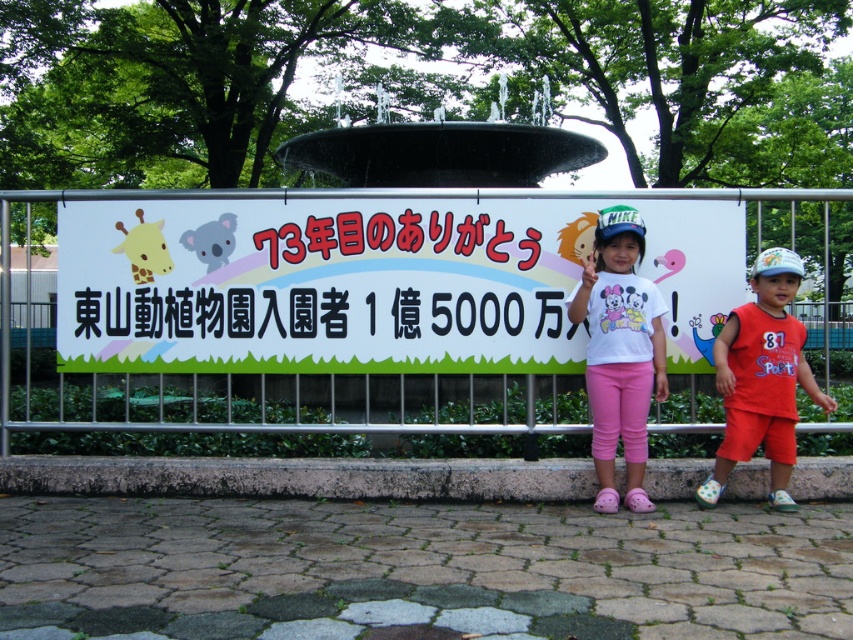
You are standing in front of the banner with the children. You want to take a photo of the fountain in the background without the banner blocking the view. The banner is attached to the metal fence. Where should you move to in relation to the point at coordinates point (103,257) to ensure the banner is out of the frame?

To avoid the banner blocking the fountain, move 5.87 meters away from the point at coordinates point (103,257) towards the direction away from the banner. This distance ensures the banner is no longer in the frame.

You are a photographer trying to capture both the pink fabric pants at center and the orange cotton shorts at right in a single frame. Which clothing item appears smaller in the photo?

The pink fabric pants at center appears smaller in the photo because it has a smaller size compared to the orange cotton shorts at right.